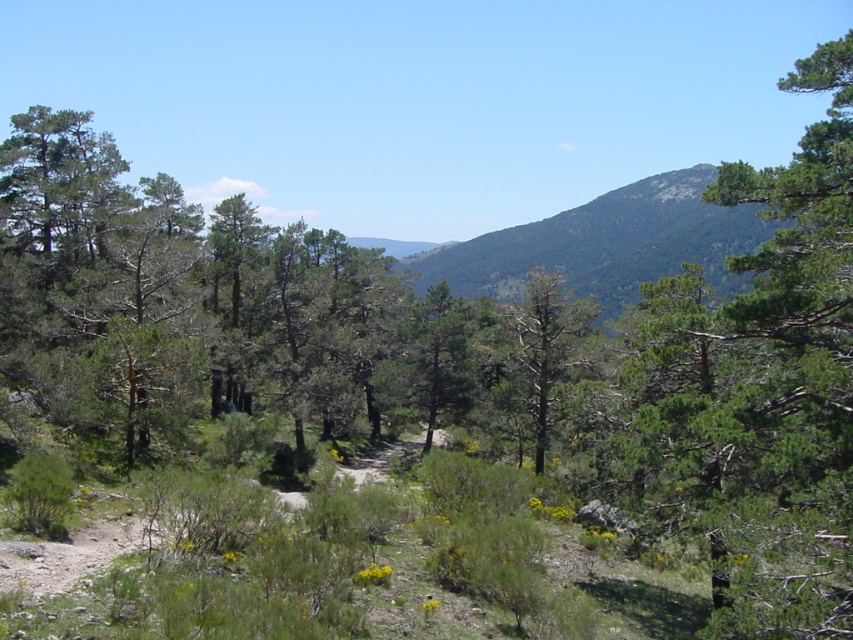
You are a hiker walking along the dirt path in the forest. You notice two trees ahead of you. The first is the green leafy tree at upper right and the second is the green textured tree at center. Which tree is positioned more to the east if you are facing north?

The green leafy tree at upper right is to the right of the green textured tree at center. Since you are facing north, your right side points east. Therefore, the green leafy tree at upper right is positioned more to the east compared to the green textured tree at center.

You are standing at the starting point of the dirt path in the forest. You notice a green leafy tree at upper right. Based on its position, can you determine if it is closer to the top or the right edge of the image?

The green leafy tree at upper right is located at point coordinates approximately 0.606 on the x axis and 0.897 on the y axis. Since both coordinates are close to 1, it is positioned near the upper right corner. Comparing the x and y values, the y coordinate is higher, meaning it is closer to the top edge than the right edge of the image.

You are standing on the dirt path in the forest. You see a point marked at coordinates (764,387). What object is located at that point?

The point at coordinates (764,387) marks the location of the green leafy tree at upper right.